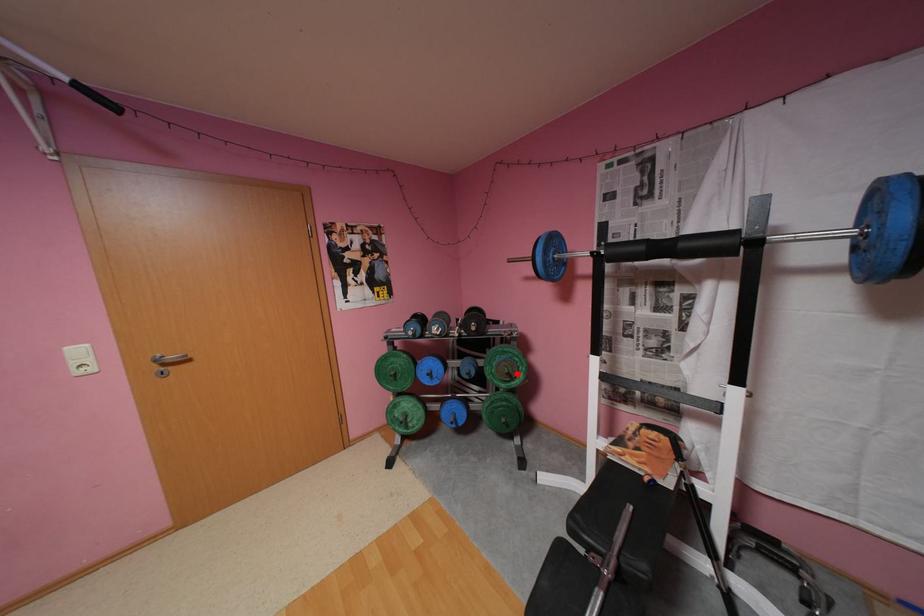
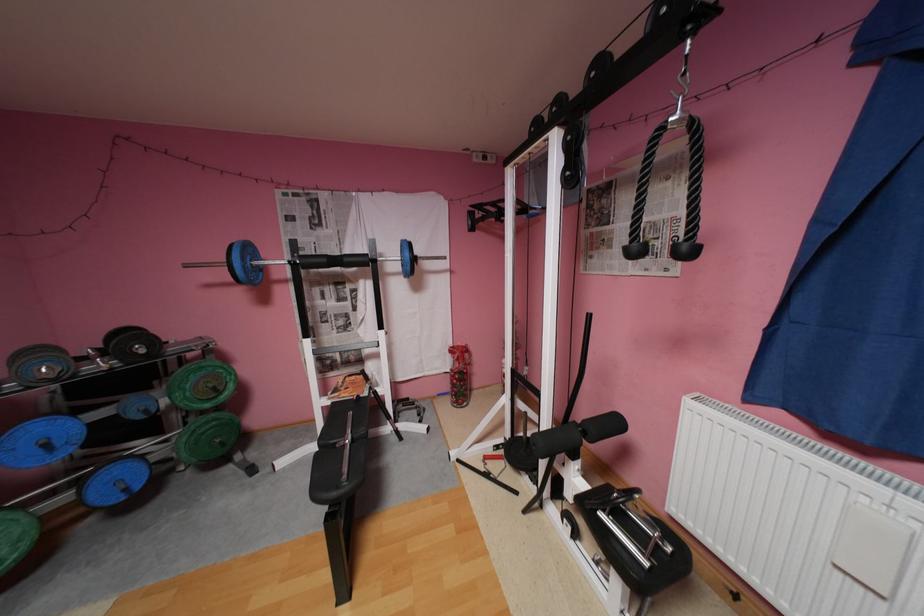
Find the pixel in the second image that matches the highlighted location in the first image.

(224, 387)